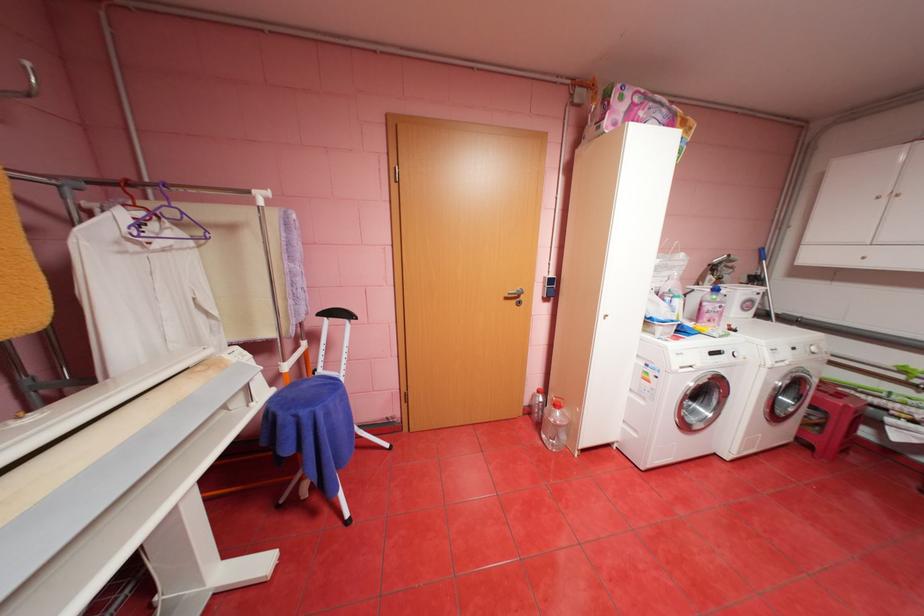
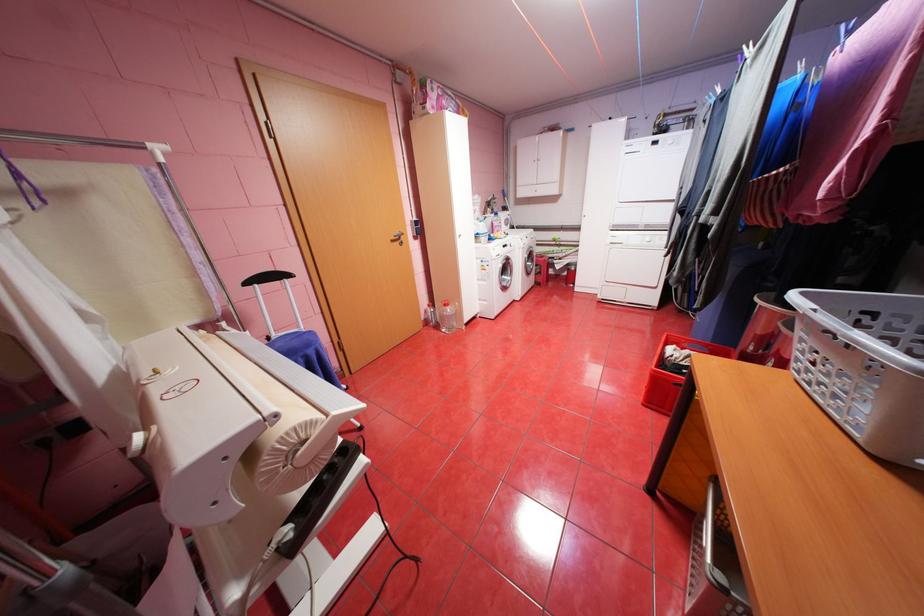
Locate, in the second image, the point that corresponds to the point at 515,298 in the first image.

(400, 241)